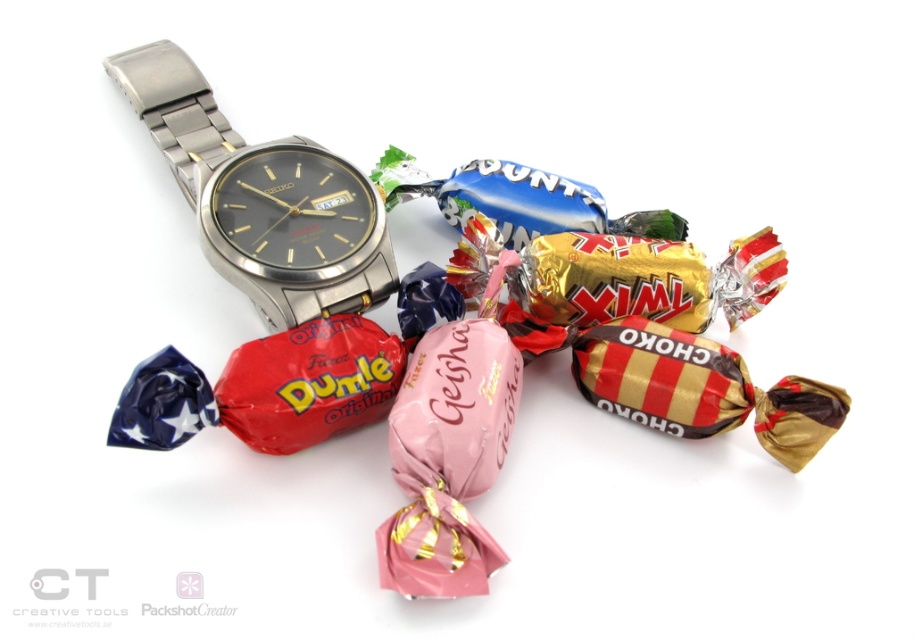
Question: Does satin silver watch at upper left appear over metallic watch at center?

Choices:
 (A) no
 (B) yes

Answer: (B)

Question: Does satin silver watch at upper left have a greater width compared to metallic watch at center?

Choices:
 (A) yes
 (B) no

Answer: (A)

Question: Does satin silver watch at upper left have a smaller size compared to metallic watch at center?

Choices:
 (A) no
 (B) yes

Answer: (A)